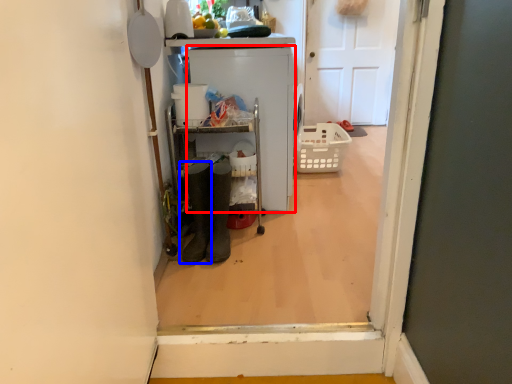
Question: Which of the following is the closest to the observer, appliance (highlighted by a red box) or footwear (highlighted by a blue box)?

Choices:
 (A) appliance
 (B) footwear

Answer: (B)